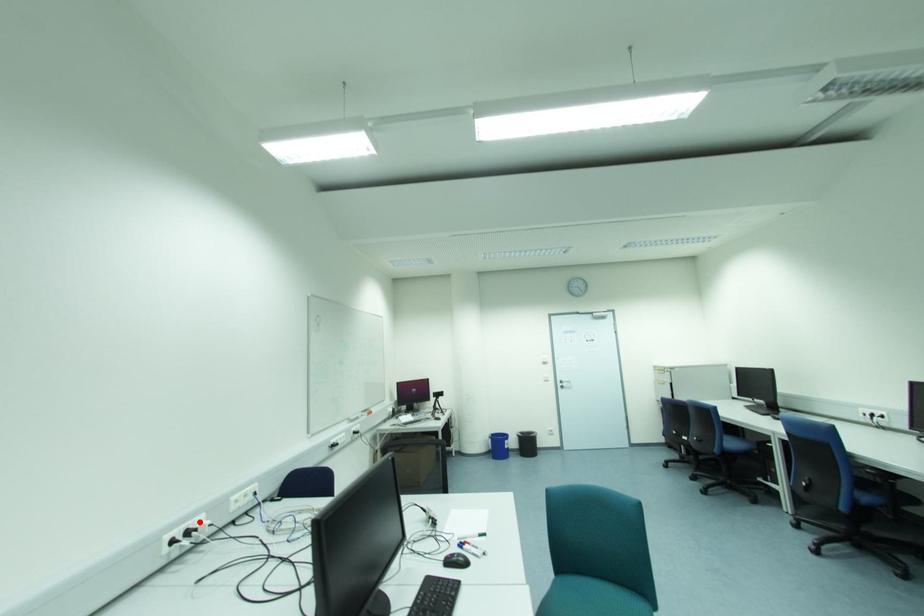
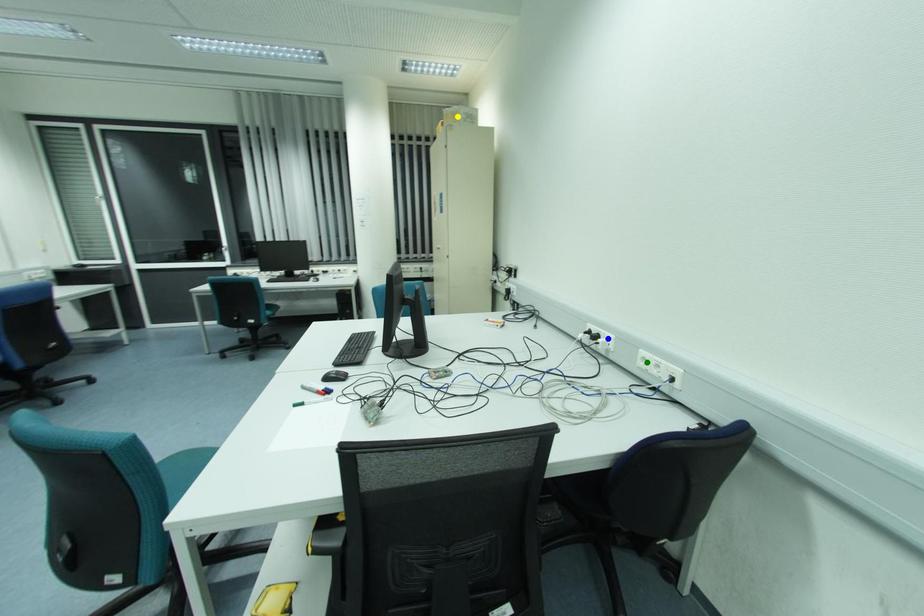
Question: I am providing you with two images of the same scene from different viewpoints. A red point is marked on the first image. You are given multiple points on the second image. Can you choose the point in image 2 that corresponds to the point in image 1?

Choices:
 (A) blue point
 (B) green point
 (C) yellow point

Answer: (A)